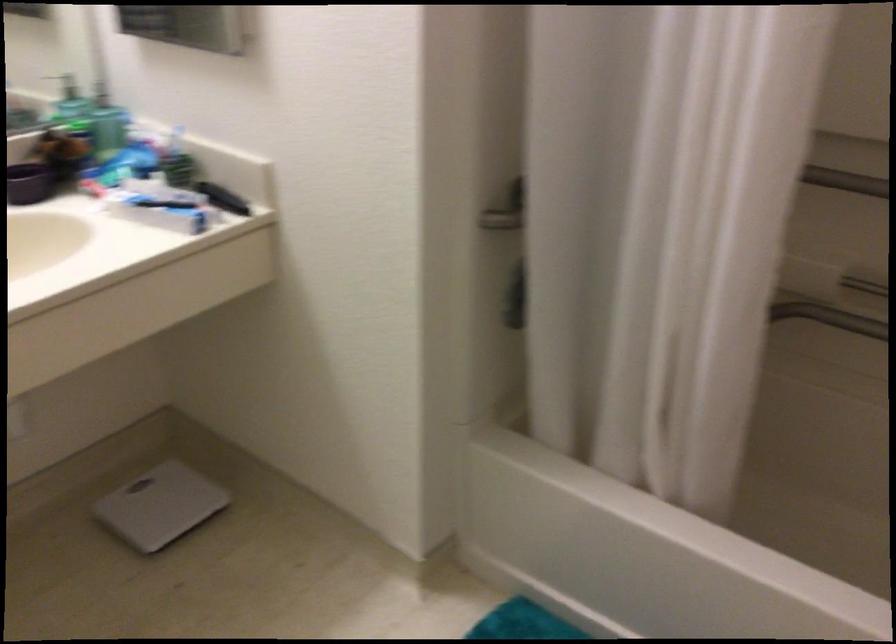
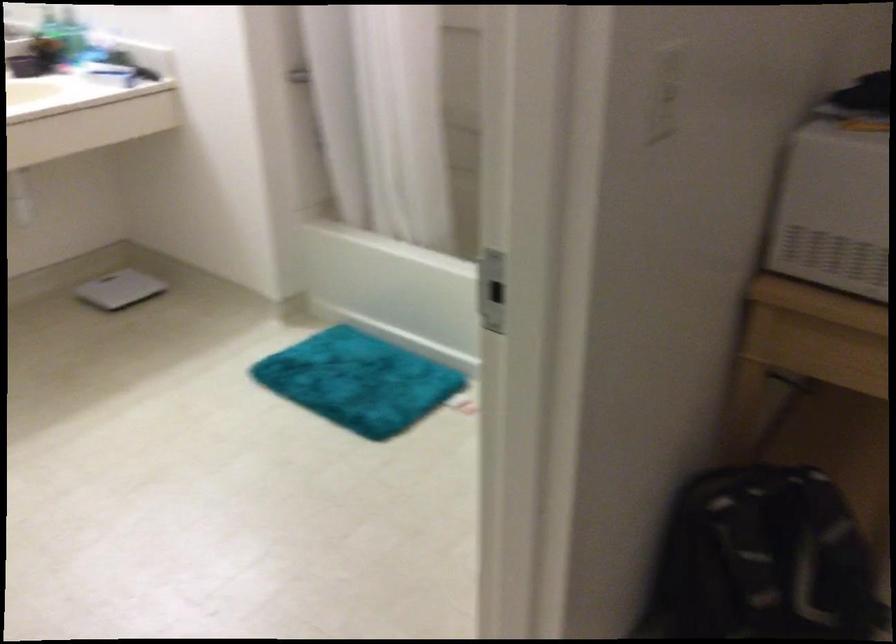
Find the pixel in the second image that matches [170,507] in the first image.

(119, 289)